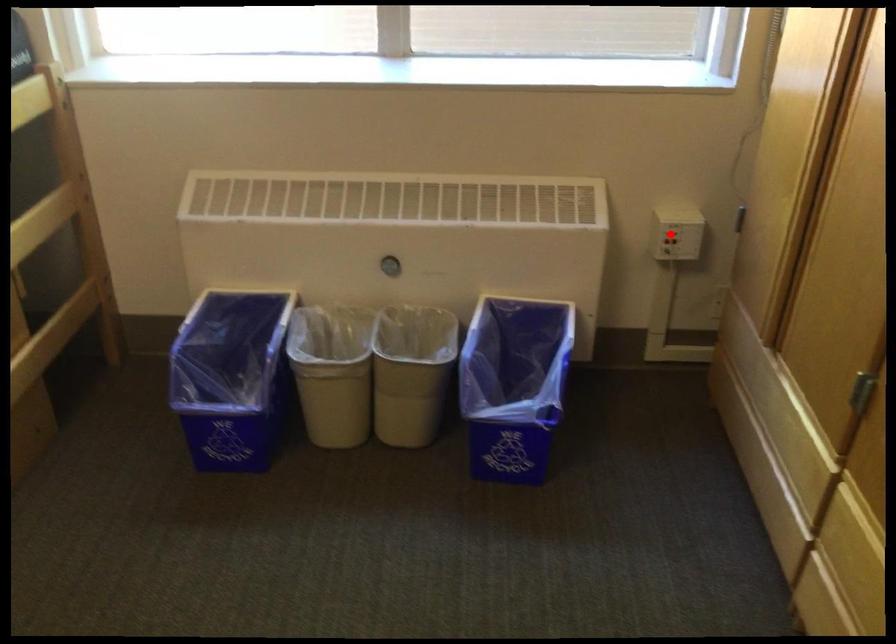
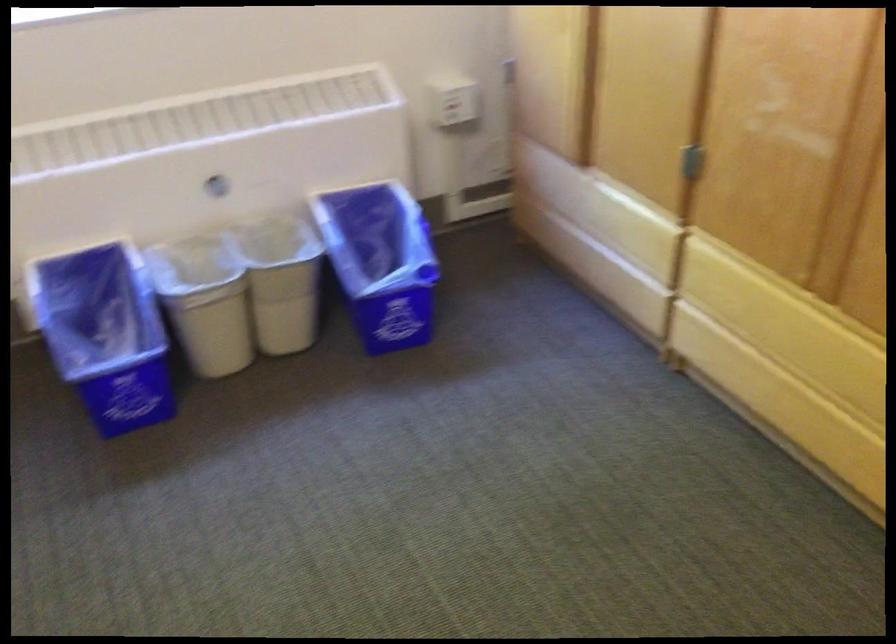
Question: A red point is marked in image1. In image2, is the corresponding 3D point closer to the camera or farther? Reply with the corresponding letter.

Choices:
 (A) The corresponding 3D point is closer.
 (B) The corresponding 3D point is farther.

Answer: (B)